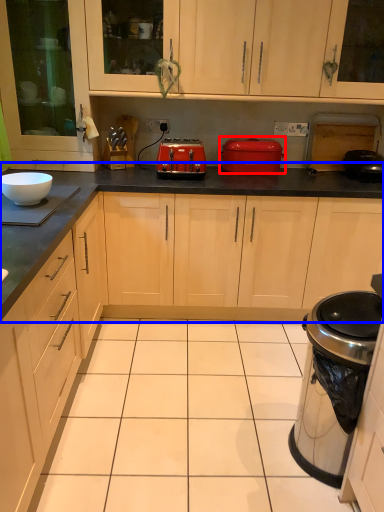
Question: Among these objects, which one is farthest to the camera, kitchen appliance (highlighted by a red box) or countertop (highlighted by a blue box)?

Choices:
 (A) kitchen appliance
 (B) countertop

Answer: (A)